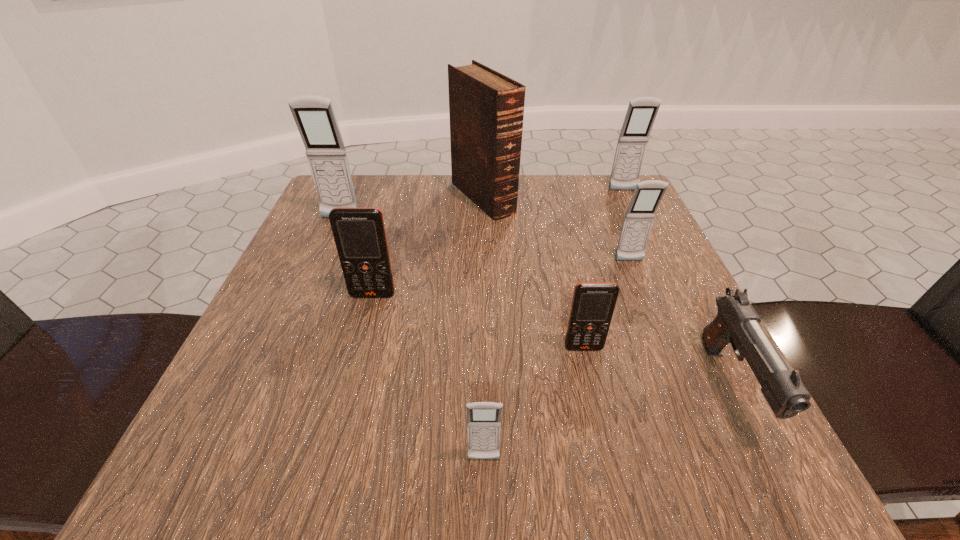
Where is `the smaller orange cellular telephone`? the smaller orange cellular telephone is located at coordinates (593, 303).

Find the location of a particular element. the nearest object is located at coordinates (483, 418).

You are a GUI agent. You are given a task and a screenshot of the screen. Output one action in this format:
    pyautogui.click(x=<x>, y=<y>)
    Task: Click on the nearest gray cellular telephone
    
    Given the screenshot: What is the action you would take?
    pyautogui.click(x=483, y=418)

The width and height of the screenshot is (960, 540). Identify the location of gray gun. (736, 322).

At what (x,y) coordinates should I click in order to perform the action: click on vacant space situated 0.120m on the left of the Bible. Please return your answer as a coordinate pair (x, y). Looking at the image, I should click on coord(399,198).

Where is `vacant area situated 0.310m on the front-facing side of the biggest gray cellular telephone`? Image resolution: width=960 pixels, height=540 pixels. vacant area situated 0.310m on the front-facing side of the biggest gray cellular telephone is located at coordinates tap(292, 330).

Find the location of a particular element. This screenshot has height=540, width=960. free location located on the front-facing side of the second biggest gray cellular telephone is located at coordinates (636, 217).

Find the location of `free space located 0.140m on the front-facing side of the fifth nearest object`. free space located 0.140m on the front-facing side of the fifth nearest object is located at coordinates (653, 318).

The height and width of the screenshot is (540, 960). Identify the location of vacant space located 0.090m on the screen of the left orange cellular telephone. (362, 339).

Find the location of a particular element. The width and height of the screenshot is (960, 540). free space located on the screen of the third cellular telephone from right to left is located at coordinates 613,481.